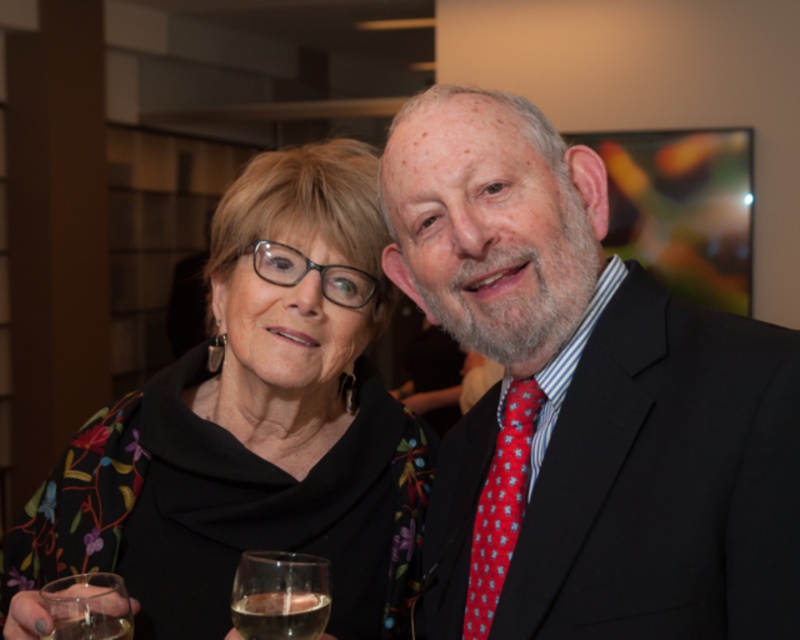
Is floral-patterned fabric at center thinner than transparent glass at lower left?

Incorrect, floral-patterned fabric at center's width is not less than transparent glass at lower left's.

Who is more forward, (385, 241) or (102, 586)?

Point (102, 586)

Identify the location of floral-patterned fabric at center. (254, 422).

Is floral-patterned fabric at center thinner than translucent glass at lower left?

No.

Does floral-patterned fabric at center appear on the right side of translucent glass at lower left?

Correct, you'll find floral-patterned fabric at center to the right of translucent glass at lower left.

Locate an element on the screen. This screenshot has width=800, height=640. floral-patterned fabric at center is located at coordinates (254, 422).

Is point (498, 577) closer to viewer compared to point (96, 620)?

No, it is not.

Who is more distant from viewer, (518, 506) or (126, 632)?

Point (518, 506)

This screenshot has width=800, height=640. Identify the location of red dotted fabric tie at right. (500, 506).